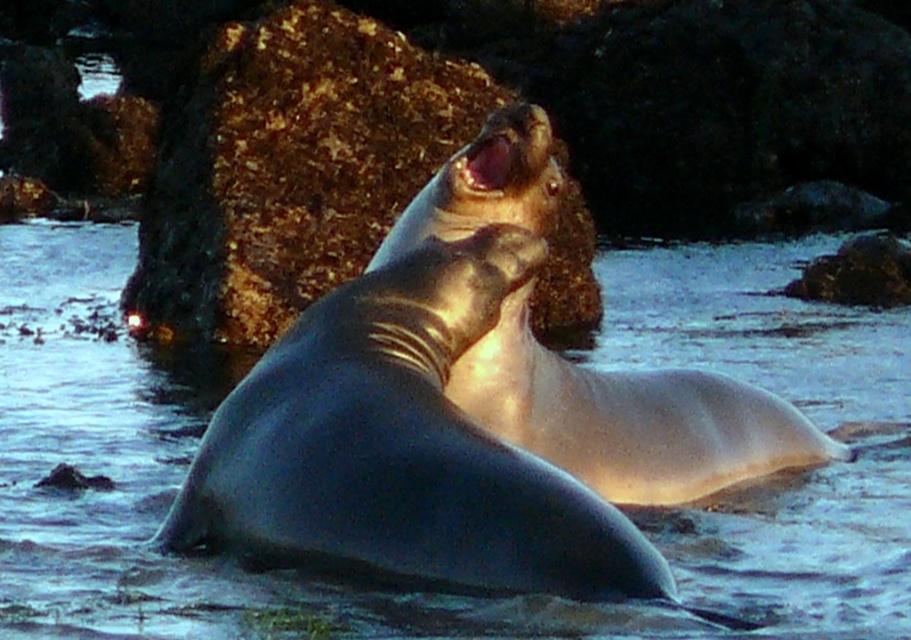
Is clear water at seal left bigger than shiny gray seal at center?

No.

This screenshot has height=640, width=911. What are the coordinates of `clear water at seal left` in the screenshot? It's located at (443, 595).

At what (x,y) coordinates should I click in order to perform the action: click on clear water at seal left. Please return your answer as a coordinate pair (x, y). This screenshot has width=911, height=640. Looking at the image, I should click on (443, 595).

Does rusty rock at center have a lesser height compared to shiny gray seal at center?

Answer: Incorrect, rusty rock at center's height does not fall short of shiny gray seal at center's.

Locate an element on the screen. This screenshot has height=640, width=911. rusty rock at center is located at coordinates (289, 164).

Where is `rusty rock at center`? rusty rock at center is located at coordinates (289, 164).

Which is more to the right, clear water at seal left or rusty rock at center?

clear water at seal left

From the picture: Between clear water at seal left and rusty rock at center, which one has more height?

With more height is rusty rock at center.

Identify the location of clear water at seal left. The image size is (911, 640). (443, 595).